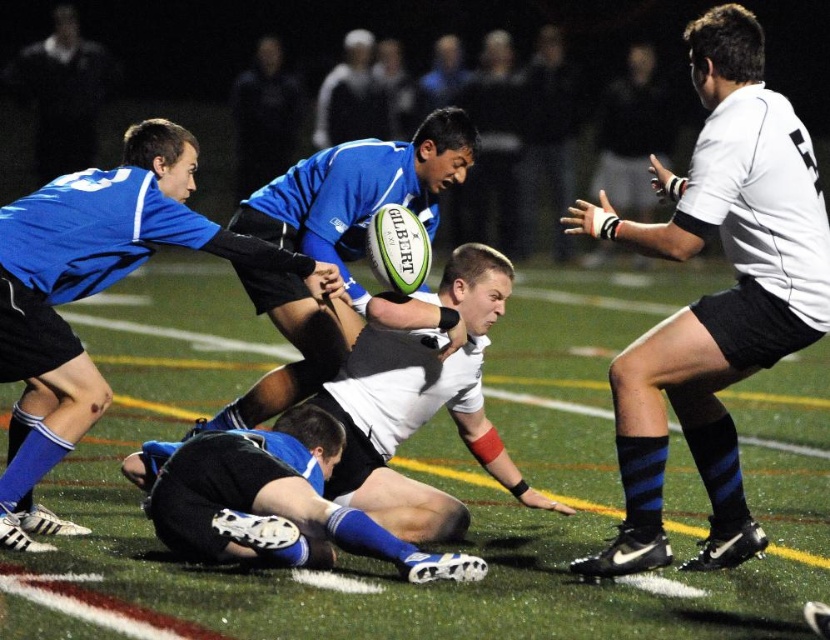
Who is shorter, blue jersey at upper left or blue jersey rugby player at center?

Standing shorter between the two is blue jersey rugby player at center.

Can you confirm if blue jersey at upper left is positioned above blue jersey rugby player at center?

Incorrect, blue jersey at upper left is not positioned above blue jersey rugby player at center.

Between point (103, 260) and point (311, 381), which one is positioned in front?

Point (103, 260)

Find the location of a particular element. This screenshot has height=640, width=830. blue jersey at upper left is located at coordinates (90, 294).

Based on the photo, does green turf at center appear on the left side of white/black jersey at center?

Yes, green turf at center is to the left of white/black jersey at center.

Which is more to the left, green turf at center or white/black jersey at center?

green turf at center is more to the left.

The image size is (830, 640). I want to click on green turf at center, so click(453, 468).

In the scene shown: Is white/black jersey at center closer to camera compared to black synthetic shorts at center?

That is True.

Does point (694, 44) lie behind point (316, 525)?

No, it is not.

Find the location of a particular element. This screenshot has width=830, height=640. white/black jersey at center is located at coordinates (715, 292).